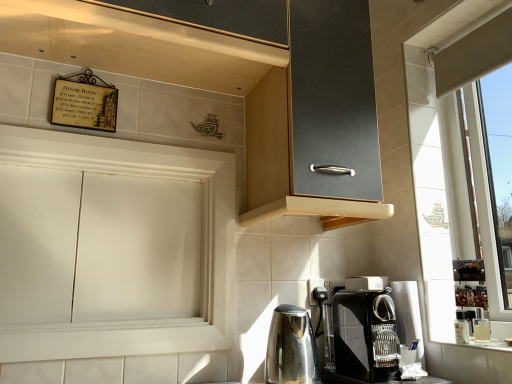
Question: Should I look upward or downward to see matte black cabinet at upper center, the 2th cabinetry from the bottom?

Choices:
 (A) up
 (B) down

Answer: (A)

Question: Can you confirm if white matte cabinet at left, the first cabinetry in the bottom-to-top sequence, is taller than black glossy coffee maker at lower right?

Choices:
 (A) no
 (B) yes

Answer: (B)

Question: From the image's perspective, does white matte cabinet at left, the 2th cabinetry in the top-to-bottom sequence, appear lower than black glossy coffee maker at lower right?

Choices:
 (A) yes
 (B) no

Answer: (B)

Question: From the image's perspective, is white matte cabinet at left, the 2th cabinetry in the top-to-bottom sequence, located above black glossy coffee maker at lower right?

Choices:
 (A) no
 (B) yes

Answer: (B)

Question: Are white matte cabinet at left, the first cabinetry in the bottom-to-top sequence, and black glossy coffee maker at lower right far apart?

Choices:
 (A) no
 (B) yes

Answer: (A)

Question: Is white matte cabinet at left, the 2th cabinetry in the top-to-bottom sequence, thinner than black glossy coffee maker at lower right?

Choices:
 (A) yes
 (B) no

Answer: (A)

Question: From a real-world perspective, is white matte cabinet at left, the 2th cabinetry in the top-to-bottom sequence, on top of black glossy coffee maker at lower right?

Choices:
 (A) no
 (B) yes

Answer: (B)

Question: Considering the relative sizes of matte black cabinet at upper center, marked as the first cabinetry in a top-to-bottom arrangement, and black glossy coffee maker at lower right in the image provided, is matte black cabinet at upper center, marked as the first cabinetry in a top-to-bottom arrangement, smaller than black glossy coffee maker at lower right?

Choices:
 (A) yes
 (B) no

Answer: (B)

Question: From a real-world perspective, is matte black cabinet at upper center, the 2th cabinetry from the bottom, under black glossy coffee maker at lower right?

Choices:
 (A) no
 (B) yes

Answer: (A)

Question: Considering the relative positions of matte black cabinet at upper center, marked as the first cabinetry in a top-to-bottom arrangement, and black glossy coffee maker at lower right in the image provided, is matte black cabinet at upper center, marked as the first cabinetry in a top-to-bottom arrangement, to the right of black glossy coffee maker at lower right from the viewer's perspective?

Choices:
 (A) no
 (B) yes

Answer: (A)

Question: Does matte black cabinet at upper center, the 2th cabinetry from the bottom, lie in front of black glossy coffee maker at lower right?

Choices:
 (A) no
 (B) yes

Answer: (B)

Question: From a real-world perspective, is matte black cabinet at upper center, marked as the first cabinetry in a top-to-bottom arrangement, over black glossy coffee maker at lower right?

Choices:
 (A) no
 (B) yes

Answer: (B)

Question: Is matte black cabinet at upper center, the 2th cabinetry from the bottom, beside black glossy coffee maker at lower right?

Choices:
 (A) no
 (B) yes

Answer: (A)

Question: Considering the relative sizes of polished stainless steel kettle at lower center and white matte cabinet at left, the 2th cabinetry in the top-to-bottom sequence, in the image provided, is polished stainless steel kettle at lower center taller than white matte cabinet at left, the 2th cabinetry in the top-to-bottom sequence,?

Choices:
 (A) no
 (B) yes

Answer: (A)